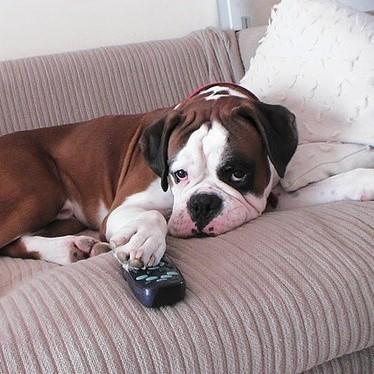
Where is `lined tan couch seat, diagonal bottom`? lined tan couch seat, diagonal bottom is located at coordinates (344, 261), (292, 311), (252, 334), (181, 350), (98, 362).